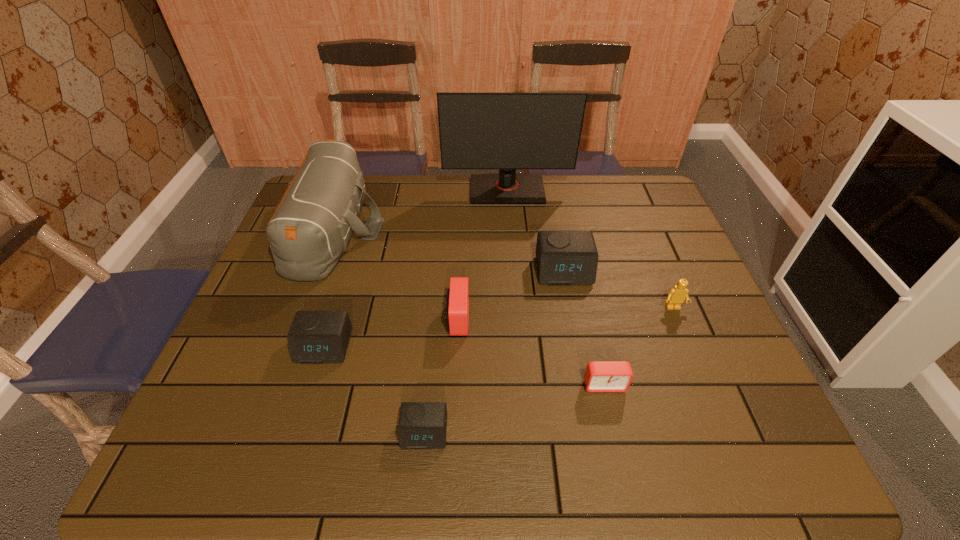
Where is `the seventh farthest object`? The width and height of the screenshot is (960, 540). the seventh farthest object is located at coordinates (600, 376).

The height and width of the screenshot is (540, 960). I want to click on the second nearest alarm clock, so click(x=600, y=376).

The width and height of the screenshot is (960, 540). Find the location of `the shortest object`. the shortest object is located at coordinates click(x=422, y=425).

Identify the location of the smallest black alarm clock. This screenshot has height=540, width=960. (422, 425).

Image resolution: width=960 pixels, height=540 pixels. In order to click on vacant point located 0.360m on the screen side of the monitor in this screenshot , I will do `click(515, 285)`.

At what (x,y) coordinates should I click in order to perform the action: click on free space located on the right of the second tallest object. Please return your answer as a coordinate pair (x, y). Image resolution: width=960 pixels, height=540 pixels. Looking at the image, I should click on (439, 230).

Identify the location of free space located 0.230m on the front-facing side of the farthest alarm clock. (581, 358).

The width and height of the screenshot is (960, 540). Identify the location of vacant space situated on the face of the rightmost object. (711, 402).

What are the coordinates of `free space located 0.060m on the front-facing side of the left red alarm clock` in the screenshot? It's located at (493, 319).

This screenshot has width=960, height=540. In order to click on vacant space located 0.140m on the front-facing side of the leftmost black alarm clock in this screenshot , I will do `click(301, 422)`.